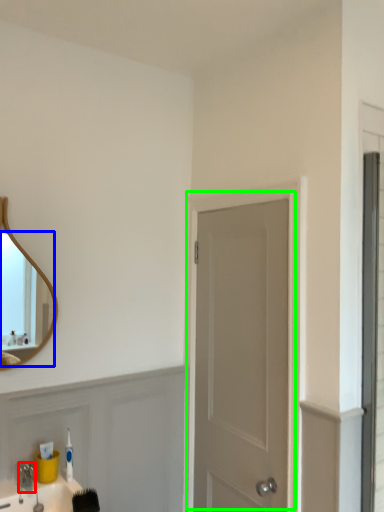
Question: Which object is positioned farthest from faucet (highlighted by a red box)? Select from mirror (highlighted by a blue box) and door (highlighted by a green box).

Choices:
 (A) mirror
 (B) door

Answer: (A)